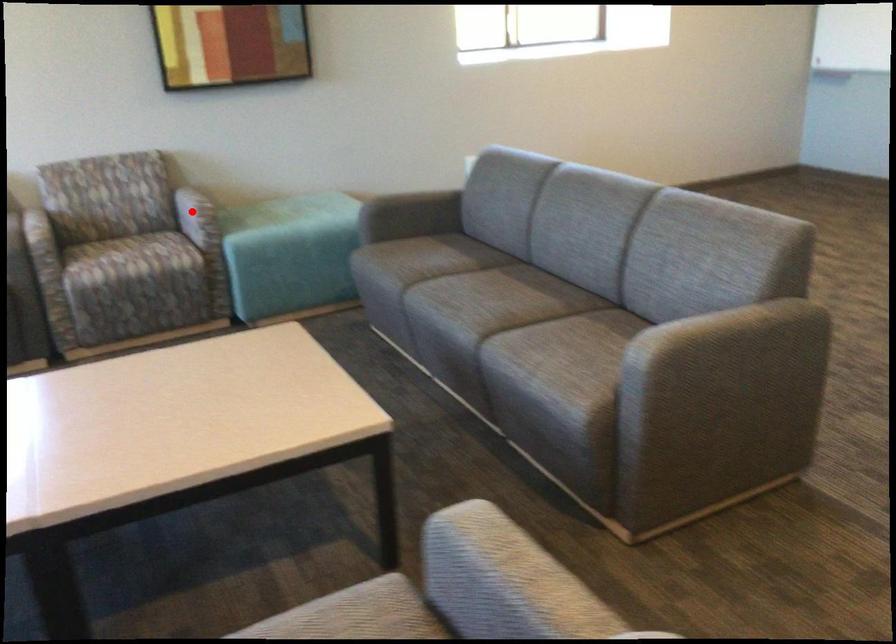
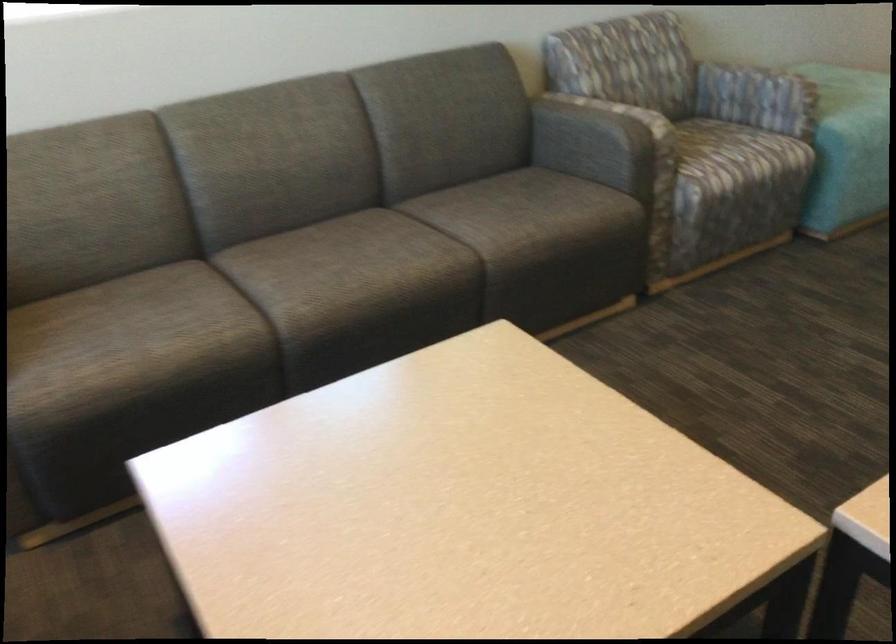
Question: A red point is marked in image1. In image2, is the corresponding 3D point closer to the camera or farther? Reply with the corresponding letter.

Choices:
 (A) The corresponding 3D point is closer.
 (B) The corresponding 3D point is farther.

Answer: (A)